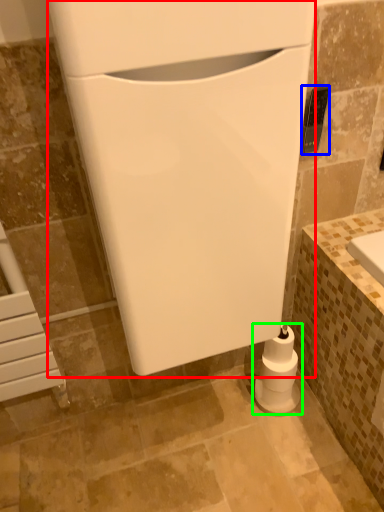
Question: Considering the real-world distances, which object is farthest from appliance (highlighted by a red box)? appliance (highlighted by a blue box) or toilet paper (highlighted by a green box)?

Choices:
 (A) appliance
 (B) toilet paper

Answer: (B)